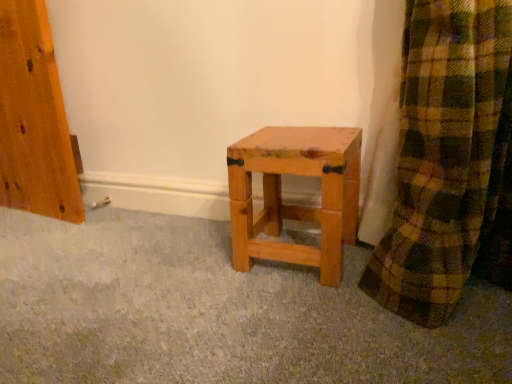
Describe the element at coordinates (214, 312) in the screenshot. I see `natural wood stool at center` at that location.

Where is `natural wood stool at center`? The height and width of the screenshot is (384, 512). natural wood stool at center is located at coordinates (214, 312).

The height and width of the screenshot is (384, 512). Describe the element at coordinates (291, 205) in the screenshot. I see `natural wood stool at center` at that location.

What is the approximate height of natural wood stool at center?

11.68 inches.

Find the location of a particular element. This screenshot has height=384, width=512. natural wood stool at center is located at coordinates (291, 205).

Where is `natural wood stool at center`? The height and width of the screenshot is (384, 512). natural wood stool at center is located at coordinates (214, 312).

In the image, is natural wood stool at center on the left side or the right side of natural wood stool at center?

natural wood stool at center is positioned on natural wood stool at center's right side.

Between natural wood stool at center and natural wood stool at center, which one is positioned behind?

Positioned behind is natural wood stool at center.

Does point (336, 159) appear closer or farther from the camera than point (95, 325)?

Point (336, 159).

From the image's perspective, would you say natural wood stool at center is positioned over natural wood stool at center?

Yes, from the image's perspective, natural wood stool at center is on top of natural wood stool at center.

From a real-world perspective, which is physically above, natural wood stool at center or natural wood stool at center?

natural wood stool at center, from a real-world perspective.

Which of these two, natural wood stool at center or natural wood stool at center, is wider?

natural wood stool at center.

From their relative heights in the image, would you say natural wood stool at center is taller or shorter than natural wood stool at center?

natural wood stool at center is taller than natural wood stool at center.

Does natural wood stool at center have a smaller size compared to natural wood stool at center?

Correct, natural wood stool at center occupies less space than natural wood stool at center.

Is natural wood stool at center outside of natural wood stool at center?

Yes, natural wood stool at center is not within natural wood stool at center.

Is natural wood stool at center positioned far away from natural wood stool at center?

No, there isn't a large distance between natural wood stool at center and natural wood stool at center.

Is natural wood stool at center turned away from natural wood stool at center?

natural wood stool at center is not turned away from natural wood stool at center.

How much distance is there between natural wood stool at center and natural wood stool at center?

natural wood stool at center is 7.80 inches away from natural wood stool at center.

In the image, there is a natural wood stool at center. Where is `concrete below it (from the image's perspective)`? concrete below it (from the image's perspective) is located at coordinates (214, 312).

Between natural wood stool at center and natural wood stool at center, which one appears on the right side from the viewer's perspective?

Positioned to the right is natural wood stool at center.

Which object is further away from the camera taking this photo, natural wood stool at center or natural wood stool at center?

natural wood stool at center.

Considering the positions of points (358, 279) and (308, 165), is point (358, 279) closer to camera compared to point (308, 165)?

That is False.

From the image's perspective, between natural wood stool at center and natural wood stool at center, which one is located above?

natural wood stool at center appears higher in the image.

From a real-world perspective, relative to natural wood stool at center, is natural wood stool at center vertically above or below?

natural wood stool at center is situated lower than natural wood stool at center in the real world.

Which object is wider, natural wood stool at center or natural wood stool at center?

With larger width is natural wood stool at center.

Can you confirm if natural wood stool at center is shorter than natural wood stool at center?

Correct, natural wood stool at center is not as tall as natural wood stool at center.

Is natural wood stool at center smaller than natural wood stool at center?

No, natural wood stool at center is not smaller than natural wood stool at center.

Is natural wood stool at center situated inside natural wood stool at center or outside?

natural wood stool at center lies outside natural wood stool at center.

Is natural wood stool at center not near natural wood stool at center?

natural wood stool at center is near natural wood stool at center, not far away.

Is natural wood stool at center facing towards natural wood stool at center?

No.

Identify the location of concrete below the natural wood stool at center (from the image's perspective). (214, 312).

Identify the location of stool above the natural wood stool at center (from a real-world perspective). (291, 205).

Find the location of a particular element. This screenshot has height=384, width=512. concrete in front of the natural wood stool at center is located at coordinates (214, 312).